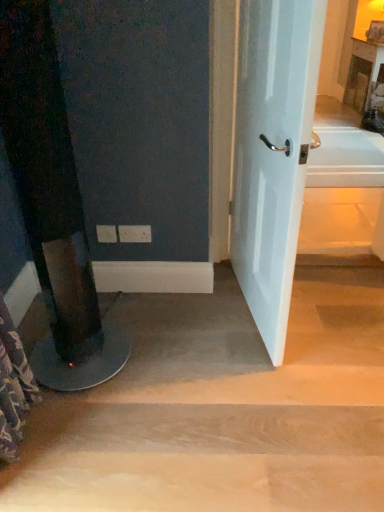
Question: Is light brown wood at lower center wider or thinner than white glossy door at center?

Choices:
 (A) thin
 (B) wide

Answer: (B)

Question: Is point (140, 300) closer or farther from the camera than point (306, 89)?

Choices:
 (A) closer
 (B) farther

Answer: (B)

Question: From the image's perspective, relative to white glossy door at center, is light brown wood at lower center above or below?

Choices:
 (A) below
 (B) above

Answer: (A)

Question: In terms of height, does white glossy door at center look taller or shorter compared to light brown wood at lower center?

Choices:
 (A) short
 (B) tall

Answer: (B)

Question: Looking at their shapes, would you say white glossy door at center is wider or thinner than light brown wood at lower center?

Choices:
 (A) wide
 (B) thin

Answer: (B)

Question: In the image, is white glossy door at center on the left side or the right side of light brown wood at lower center?

Choices:
 (A) left
 (B) right

Answer: (B)

Question: Considering the positions of white glossy door at center and light brown wood at lower center in the image, is white glossy door at center bigger or smaller than light brown wood at lower center?

Choices:
 (A) big
 (B) small

Answer: (B)